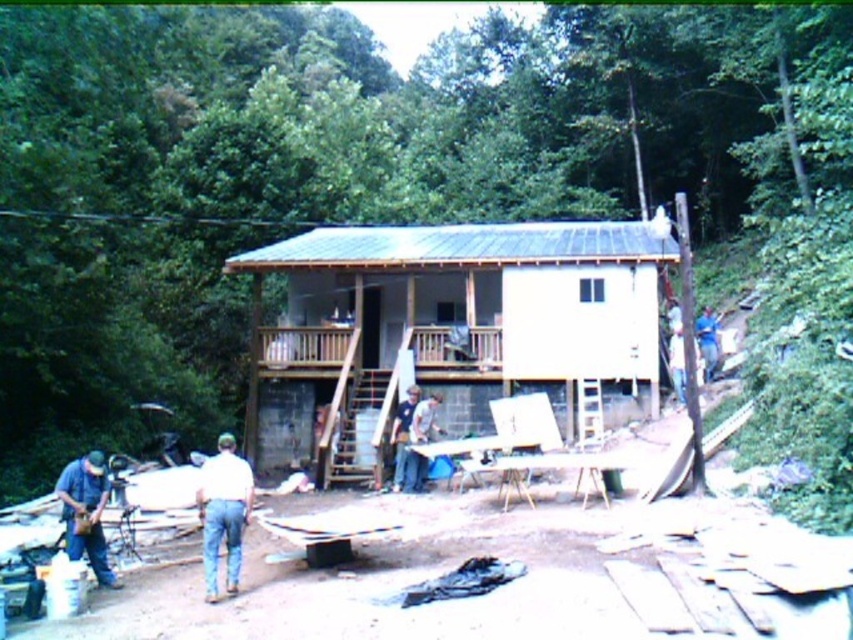
You are a construction worker standing at the denim shirt at lower left. You need to reach the brown wooden porch at center to continue building the roof. How can you get there?

The brown wooden porch at center is located above the denim shirt at lower left, so you can climb up from the denim shirt at lower left to reach the brown wooden porch at center.

You are a construction worker who needs to place a tool on the nearest available surface. You see the brown wooden porch at center and the white cotton shirt at lower center. Which surface should you choose?

The brown wooden porch at center is smaller than the white cotton shirt at lower center, so the white cotton shirt at lower center is a larger surface and more suitable for placing tools.

You are a construction worker who needs to choose between two shirts to wear for the day. You notice the white cotton shirt at lower center and the denim shirt at lower left. Which shirt is taller?

The white cotton shirt at lower center is much taller than the denim shirt at lower left.